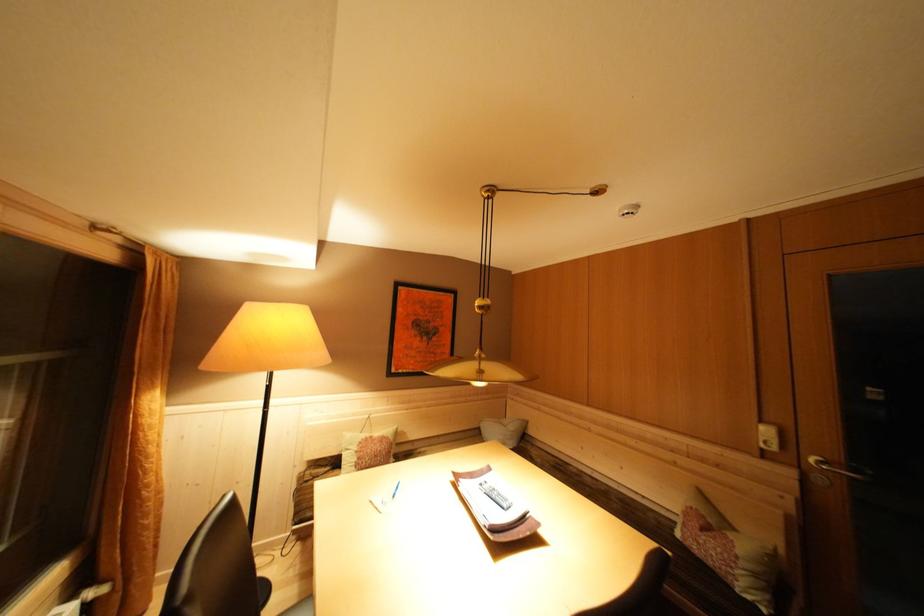
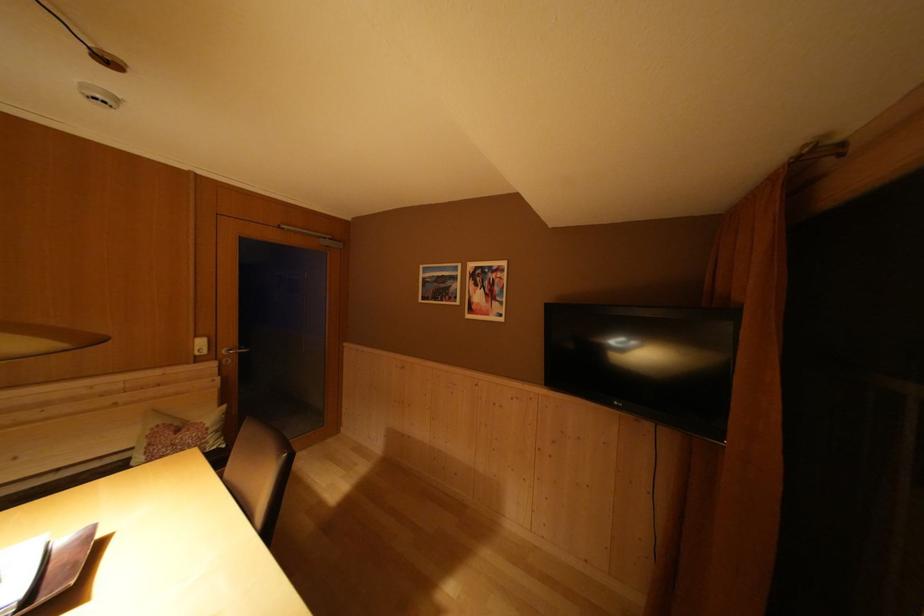
In the second image, find the point that corresponds to the point at 650,501 in the first image.

(66, 475)